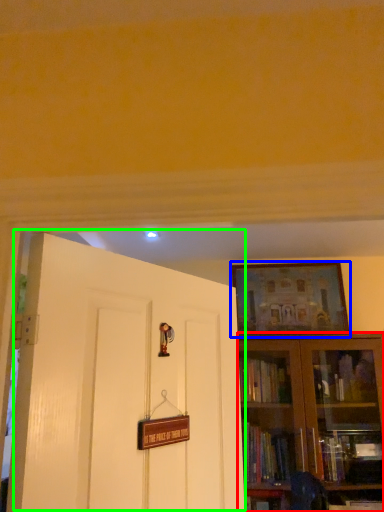
Question: Based on their relative distances, which object is nearer to bookcase (highlighted by a red box)? Choose from picture frame (highlighted by a blue box) and door (highlighted by a green box).

Choices:
 (A) picture frame
 (B) door

Answer: (A)